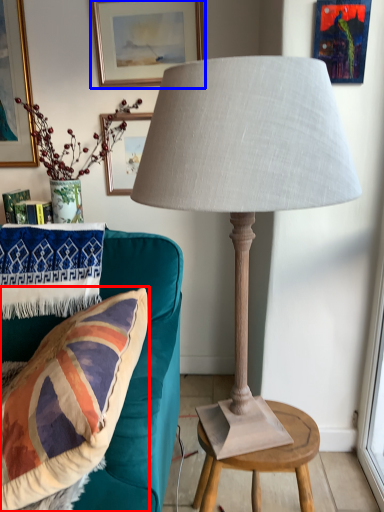
Question: Among these objects, which one is farthest to the camera, pillow (highlighted by a red box) or picture frame (highlighted by a blue box)?

Choices:
 (A) pillow
 (B) picture frame

Answer: (B)